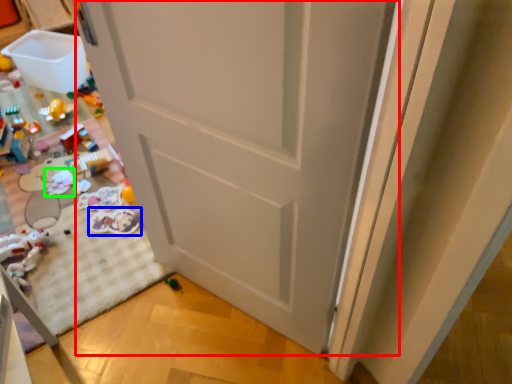
Question: Which object is the closest to the door (highlighted by a red box)? Choose among these: toy (highlighted by a blue box) or toy (highlighted by a green box).

Choices:
 (A) toy
 (B) toy

Answer: (A)